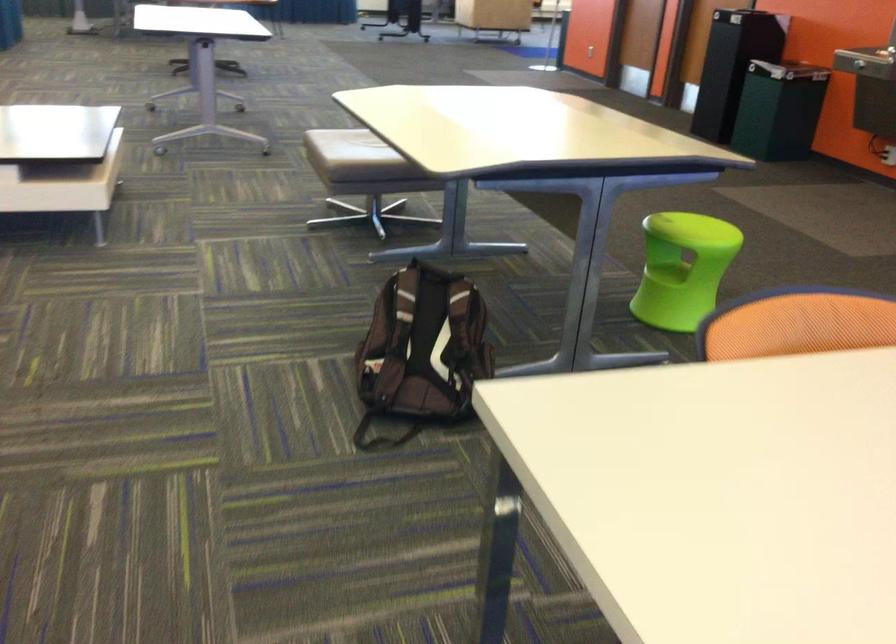
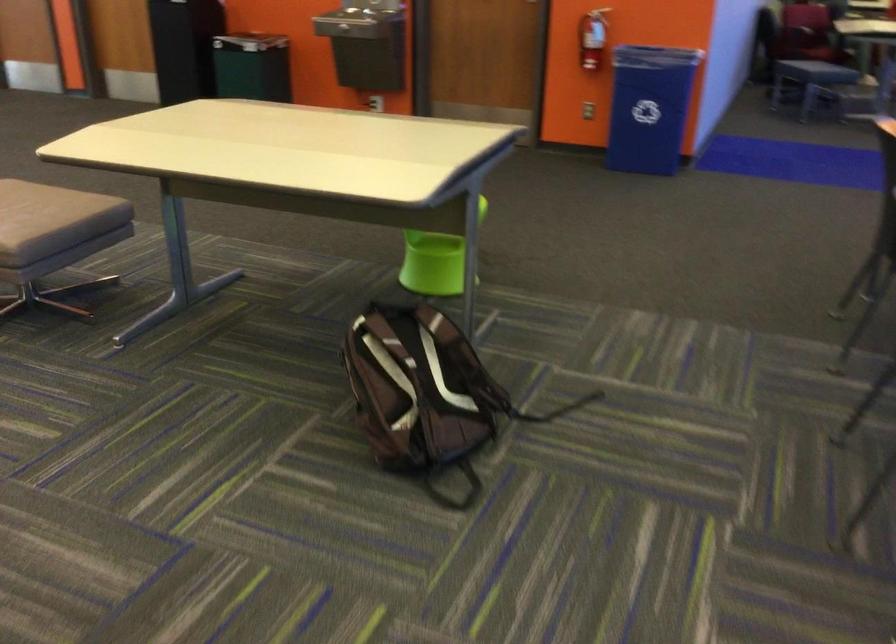
The point at (645, 290) is marked in the first image. Where is the corresponding point in the second image?

(435, 261)